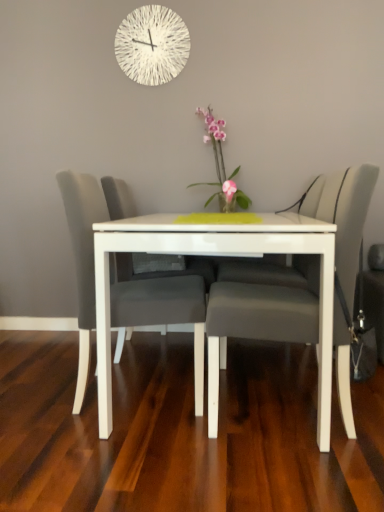
Locate an element on the screen. This screenshot has height=512, width=384. vacant space that is to the left of matte gray chair at center, the first chair viewed from the left is located at coordinates (36, 392).